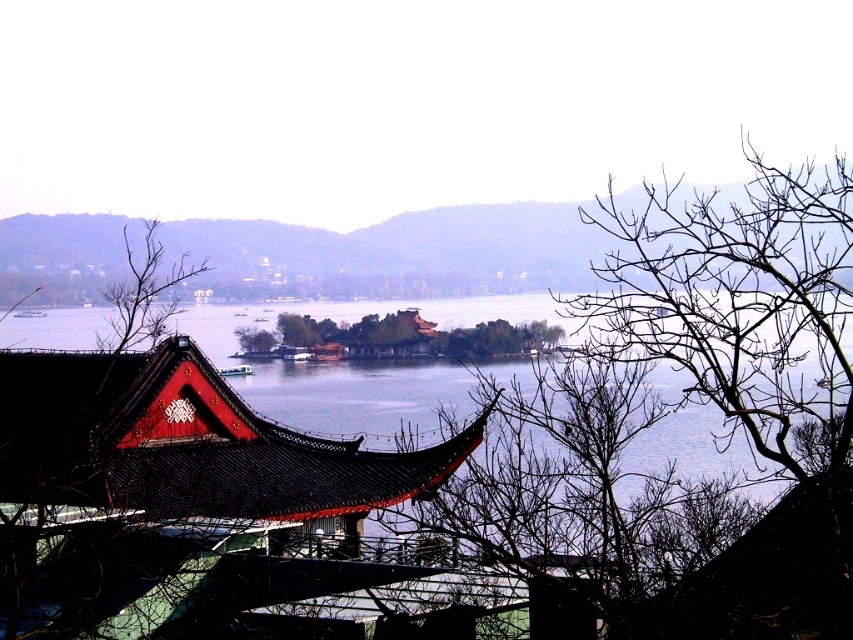
Question: Can you confirm if green leafy island at center is thinner than brown leafless tree at center?

Choices:
 (A) no
 (B) yes

Answer: (A)

Question: Which point is closer to the camera?

Choices:
 (A) green leafy island at center
 (B) brown leafless tree at center

Answer: (A)

Question: Can you confirm if green leafy island at center is wider than brown leafless tree at center?

Choices:
 (A) yes
 (B) no

Answer: (A)

Question: Can you confirm if green leafy island at center is thinner than brown leafless tree at center?

Choices:
 (A) yes
 (B) no

Answer: (B)

Question: Among these objects, which one is nearest to the camera?

Choices:
 (A) green leafy island at center
 (B) brown leafless tree at center

Answer: (A)

Question: Which point appears closest to the camera in this image?

Choices:
 (A) (407, 340)
 (B) (257, 333)

Answer: (A)